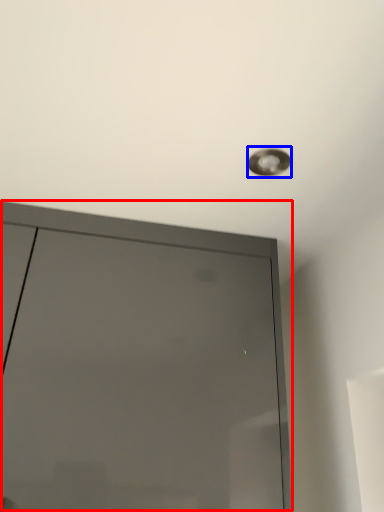
Question: Which object appears farthest to the camera in this image, door (highlighted by a red box) or droplight (highlighted by a blue box)?

Choices:
 (A) door
 (B) droplight

Answer: (B)